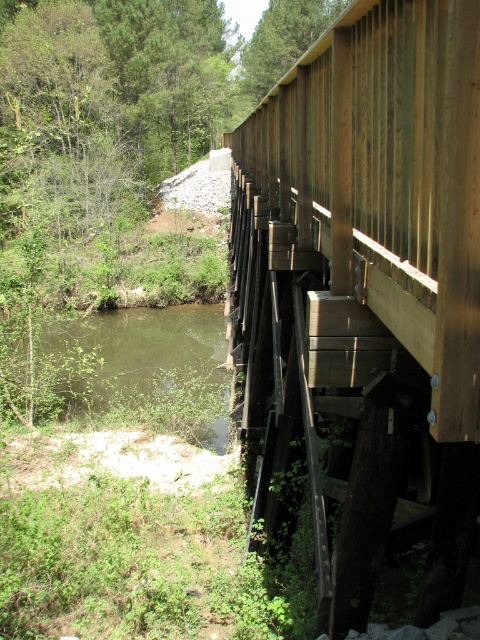
Question: Which of the following is the closest to the observer?

Choices:
 (A) (49, 342)
 (B) (287, 179)

Answer: (B)

Question: Which point appears closest to the camera in this image?

Choices:
 (A) (397, 392)
 (B) (88, 388)

Answer: (A)

Question: Is wooden bridge at right smaller than green murky water at lower left?

Choices:
 (A) no
 (B) yes

Answer: (A)

Question: Does wooden bridge at right appear on the right side of green murky water at lower left?

Choices:
 (A) yes
 (B) no

Answer: (A)

Question: Which point is farther to the camera?

Choices:
 (A) (316, 205)
 (B) (225, 342)

Answer: (B)

Question: Is wooden bridge at right in front of green murky water at lower left?

Choices:
 (A) no
 (B) yes

Answer: (B)